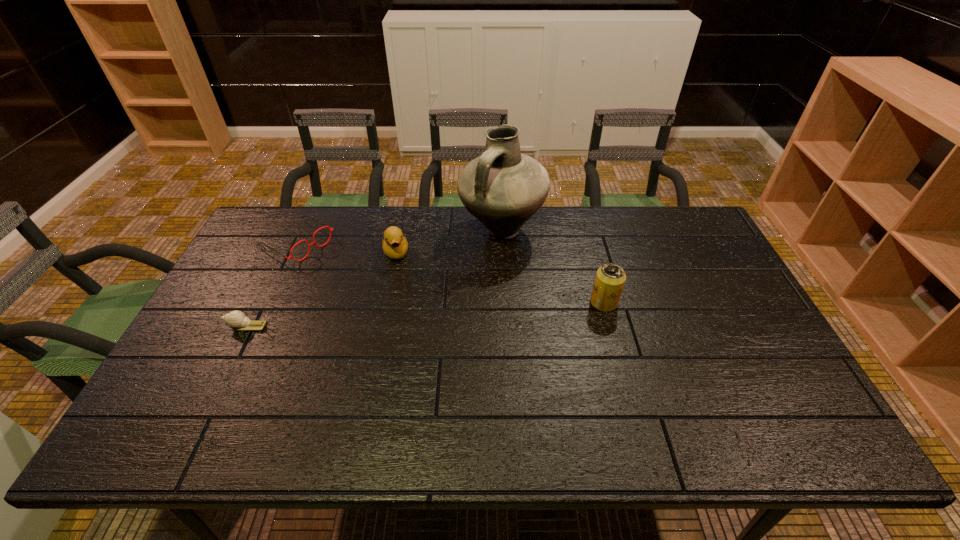
Locate an element on the screen. Image resolution: width=960 pixels, height=540 pixels. free spot between the shortest object and the beer can is located at coordinates (425, 314).

The height and width of the screenshot is (540, 960). What are the coordinates of `object that is the closest to the second nearest object` in the screenshot? It's located at pos(503,188).

Identify which object is the fourth nearest to the tallest object. Please provide its 2D coordinates. Your answer should be formatted as a tuple, i.e. [(x, y)], where the tuple contains the x and y coordinates of a point satisfying the conditions above.

[(237, 320)]

Find the location of a particular element. This screenshot has width=960, height=540. free space that satisfies the following two spatial constraints: 1. on the back side of the spectacles; 2. on the right side of the tallest object is located at coordinates (303, 231).

Identify the location of free space that satisfies the following two spatial constraints: 1. on the front side of the third object from left to right; 2. on the left side of the spectacles. (293, 253).